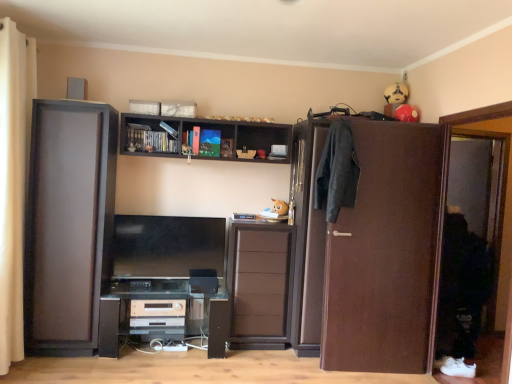
The height and width of the screenshot is (384, 512). Describe the element at coordinates (470, 220) in the screenshot. I see `brown wooden screen door at right` at that location.

Identify the location of brown wooden screen door at right. The height and width of the screenshot is (384, 512). (470, 220).

Image resolution: width=512 pixels, height=384 pixels. Describe the element at coordinates (69, 225) in the screenshot. I see `matte black cupboard at left` at that location.

Find the location of a particular element. brown wooden screen door at right is located at coordinates (470, 220).

Does point (348, 153) come behind point (192, 282)?

No.

Considering the relative sizes of dark gray fabric coat at right and satin black speaker at center, which is the first appliance in top-to-bottom order, in the image provided, is dark gray fabric coat at right taller than satin black speaker at center, which is the first appliance in top-to-bottom order,?

Indeed, dark gray fabric coat at right has a greater height compared to satin black speaker at center, which is the first appliance in top-to-bottom order.

Is dark gray fabric coat at right positioned in front of satin black speaker at center, placed as the second appliance when sorted from bottom to top?

That is True.

Is dark gray fabric coat at right bigger than satin black speaker at center, placed as the second appliance when sorted from bottom to top?

Yes, dark gray fabric coat at right is bigger than satin black speaker at center, placed as the second appliance when sorted from bottom to top.

Is dark wood shelf at upper center wider or thinner than brown matte door at right?

dark wood shelf at upper center is wider than brown matte door at right.

Is dark wood shelf at upper center aimed at brown matte door at right?

No, dark wood shelf at upper center is not aimed at brown matte door at right.

Does dark wood shelf at upper center have a lesser height compared to brown matte door at right?

Yes.

Is dark wood shelf at upper center far from brown matte door at right?

dark wood shelf at upper center is positioned a significant distance from brown matte door at right.

Considering the relative positions of brown wooden screen door at right and beige fabric curtain at left in the image provided, is brown wooden screen door at right in front of beige fabric curtain at left?

Yes, brown wooden screen door at right is closer to the camera.

How many degrees apart are the facing directions of brown wooden screen door at right and beige fabric curtain at left?

178 degrees.

From the image's perspective, which one is positioned lower, brown wooden screen door at right or beige fabric curtain at left?

brown wooden screen door at right appears lower in the image.

Is brown wooden screen door at right thinner than beige fabric curtain at left?

Yes, brown wooden screen door at right is thinner than beige fabric curtain at left.

Is satin black speaker at center, marked as the second appliance in a left-to-right arrangement, inside or outside of brown wooden screen door at right?

satin black speaker at center, marked as the second appliance in a left-to-right arrangement, cannot be found inside brown wooden screen door at right.

Considering the sizes of objects satin black speaker at center, which is the first appliance in top-to-bottom order, and brown wooden screen door at right in the image provided, who is taller, satin black speaker at center, which is the first appliance in top-to-bottom order, or brown wooden screen door at right?

With more height is brown wooden screen door at right.

Is point (205, 274) closer or farther from the camera than point (450, 172)?

Point (205, 274) appears to be closer to the viewer than point (450, 172).

From a real-world perspective, is satin black speaker at center, marked as the second appliance in a left-to-right arrangement, on top of brown wooden screen door at right?

Actually, satin black speaker at center, marked as the second appliance in a left-to-right arrangement, is physically below brown wooden screen door at right in the real world.

Is dark gray fabric coat at right bigger than black plastic computer desk at lower center?

Actually, dark gray fabric coat at right might be smaller than black plastic computer desk at lower center.

Would you say dark gray fabric coat at right is inside or outside black plastic computer desk at lower center?

dark gray fabric coat at right cannot be found inside black plastic computer desk at lower center.

Based on the photo, which of these two, dark gray fabric coat at right or black plastic computer desk at lower center, is thinner?

Thinner between the two is dark gray fabric coat at right.

Consider the image. Does dark gray fabric coat at right appear on the left side of black plastic computer desk at lower center?

No.

From the image's perspective, which one is positioned lower, silver metallic stereo at center, which ranks as the first appliance in left-to-right order, or brown wooden screen door at right?

From the image's view, silver metallic stereo at center, which ranks as the first appliance in left-to-right order, is below.

How far apart are silver metallic stereo at center, the first appliance positioned from the bottom, and brown wooden screen door at right?

A distance of 8.50 feet exists between silver metallic stereo at center, the first appliance positioned from the bottom, and brown wooden screen door at right.

Which is behind, point (147, 300) or point (480, 141)?

The point (480, 141) is farther.

How different are the orientations of silver metallic stereo at center, the second appliance when ordered from right to left, and brown wooden screen door at right in degrees?

The facing directions of silver metallic stereo at center, the second appliance when ordered from right to left, and brown wooden screen door at right are 89.8 degrees apart.

Is dark wood shelf at upper center spatially inside brown wooden screen door at right, or outside of it?

dark wood shelf at upper center lies outside brown wooden screen door at right.

Between dark wood shelf at upper center and brown wooden screen door at right, which one appears on the right side from the viewer's perspective?

brown wooden screen door at right is more to the right.

In order to click on shelf on the left side of brown wooden screen door at right in this screenshot , I will do `click(201, 131)`.

Based on the photo, in terms of width, does dark wood shelf at upper center look wider or thinner when compared to brown wooden screen door at right?

Clearly, dark wood shelf at upper center has more width compared to brown wooden screen door at right.

Find the location of a particular element. This screenshot has width=512, height=384. clothing in front of the satin black speaker at center, placed as the second appliance when sorted from bottom to top is located at coordinates (337, 171).

Where is `shelf located above the brown matte door at right (from a real-world perspective)`? shelf located above the brown matte door at right (from a real-world perspective) is located at coordinates (201, 131).

When comparing their distances from brown wooden screen door at right, does brown matte cabinet at center or dark gray fabric coat at right seem further?

brown matte cabinet at center is positioned further to the anchor brown wooden screen door at right.

From the image, which object appears to be farther from brown matte cabinet at center, satin black speaker at center, placed as the second appliance when sorted from bottom to top, or brown matte door at right?

Based on the image, brown matte door at right appears to be further to brown matte cabinet at center.

When comparing their distances from brown matte door at right, does brown matte cabinet at center or beige fabric curtain at left seem closer?

brown matte cabinet at center is closer to brown matte door at right.

Estimate the real-world distances between objects in this image. Which object is closer to satin black speaker at center, which is the first appliance in top-to-bottom order, matte black cupboard at left or dark gray fabric coat at right?

matte black cupboard at left.

When comparing their distances from satin black speaker at center, which appears as the 1th appliance when viewed from the right, does brown wooden screen door at right or dark gray fabric coat at right seem further?

brown wooden screen door at right.

Looking at the image, which one is located further to black plastic computer desk at lower center, satin black speaker at center, which appears as the 1th appliance when viewed from the right, or brown matte cabinet at center?

brown matte cabinet at center.

From the image, which object appears to be farther from satin black speaker at center, which appears as the 1th appliance when viewed from the right, black plastic computer desk at lower center or brown matte door at right?

brown matte door at right lies further to satin black speaker at center, which appears as the 1th appliance when viewed from the right, than the other object.

Which object lies nearer to the anchor point dark gray fabric coat at right, brown matte cabinet at center or beige fabric curtain at left?

brown matte cabinet at center.

You are a GUI agent. You are given a task and a screenshot of the screen. Output one action in this format:
    pyautogui.click(x=<x>, y=<y>)
    Task: Click on the cabinetry located between matte black cupboard at left and brown matte door at right in the left-right direction
    This screenshot has height=384, width=512.
    Given the screenshot: What is the action you would take?
    pyautogui.click(x=259, y=285)

The width and height of the screenshot is (512, 384). In order to click on appliance between black plastic computer desk at lower center and brown wooden screen door at right from left to right in this screenshot , I will do `click(203, 281)`.

Identify the location of cabinetry between black plastic computer desk at lower center and brown wooden screen door at right from left to right. The image size is (512, 384). (259, 285).

Where is `computer desk situated between silver metallic stereo at center, the first appliance positioned from the bottom, and dark gray fabric coat at right from left to right`? computer desk situated between silver metallic stereo at center, the first appliance positioned from the bottom, and dark gray fabric coat at right from left to right is located at coordinates (162, 313).